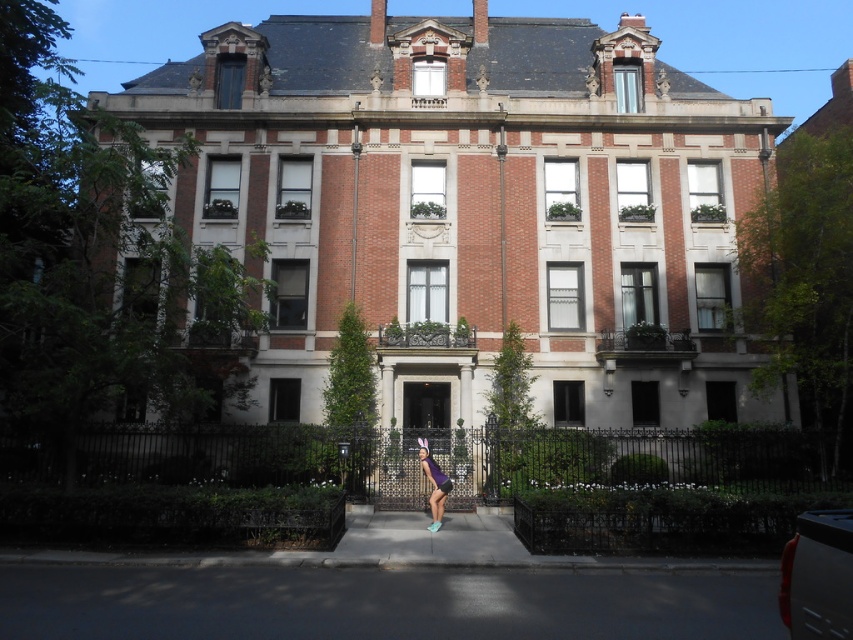
Question: Can you confirm if purple fabric shorts at center is positioned below transparent plastic umbrella at center?

Choices:
 (A) yes
 (B) no

Answer: (A)

Question: Which point is closer to the camera?

Choices:
 (A) (416, 438)
 (B) (438, 504)

Answer: (B)

Question: Is purple fabric shorts at center smaller than transparent plastic umbrella at center?

Choices:
 (A) no
 (B) yes

Answer: (A)

Question: Does purple fabric shorts at center have a greater width compared to transparent plastic umbrella at center?

Choices:
 (A) no
 (B) yes

Answer: (B)

Question: Which object appears farthest from the camera in this image?

Choices:
 (A) purple fabric shorts at center
 (B) transparent plastic umbrella at center

Answer: (B)